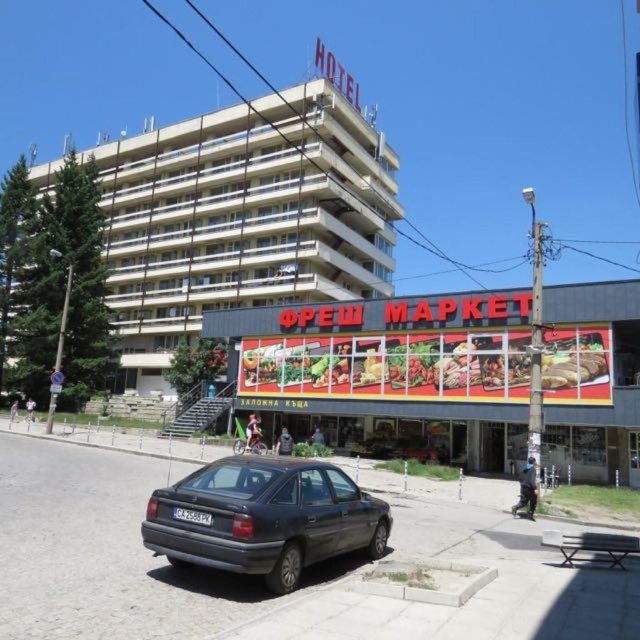
Question: Does beige concrete building at upper center have a greater width compared to matte dark gray sedan at lower center?

Choices:
 (A) no
 (B) yes

Answer: (B)

Question: Can you confirm if beige concrete building at upper center is positioned above matte dark gray sedan at lower center?

Choices:
 (A) yes
 (B) no

Answer: (A)

Question: Which of the following is the closest to the observer?

Choices:
 (A) beige concrete building at upper center
 (B) matte dark gray sedan at lower center

Answer: (B)

Question: Is beige concrete building at upper center positioned at the back of matte dark gray sedan at lower center?

Choices:
 (A) no
 (B) yes

Answer: (B)